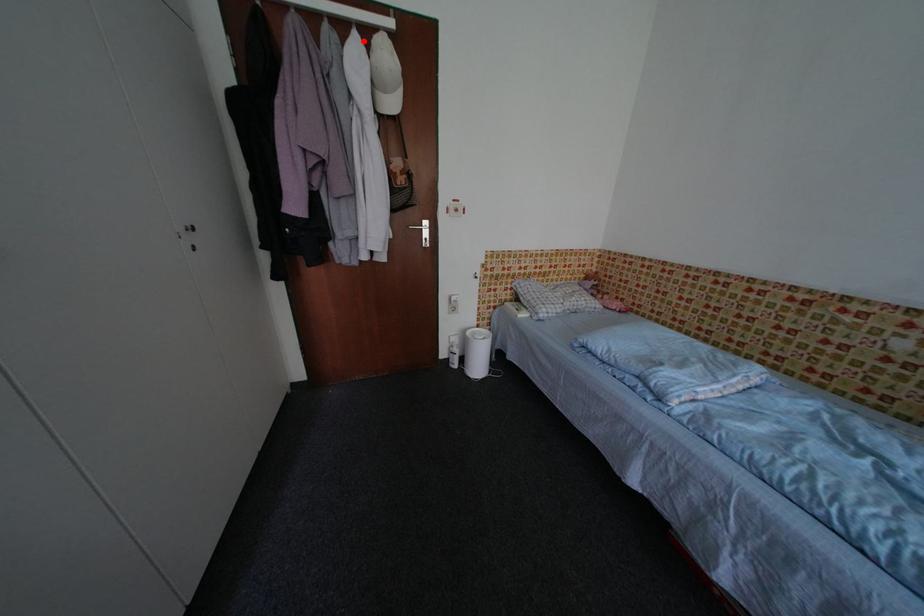
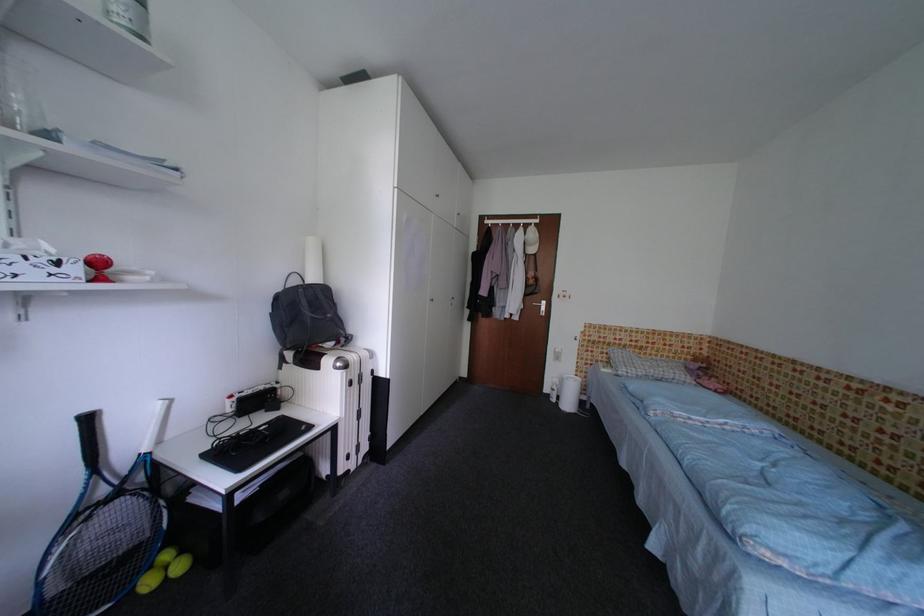
Find the pixel in the second image that matches the highlighted location in the first image.

(529, 232)